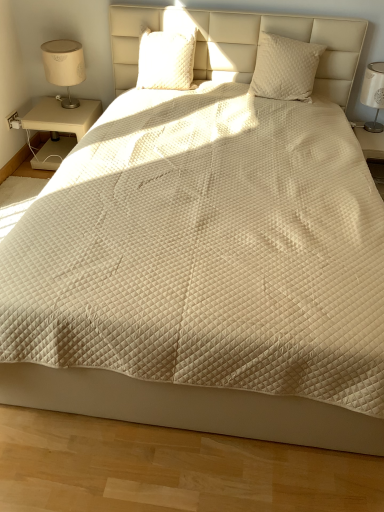
Question: Considering the relative sizes of beige wood nightstand at left and white fabric lampshade at right in the image provided, is beige wood nightstand at left smaller than white fabric lampshade at right?

Choices:
 (A) no
 (B) yes

Answer: (A)

Question: Does beige wood nightstand at left have a lesser height compared to white fabric lampshade at right?

Choices:
 (A) yes
 (B) no

Answer: (A)

Question: Is beige wood nightstand at left turned away from white fabric lampshade at right?

Choices:
 (A) no
 (B) yes

Answer: (A)

Question: From the image's perspective, does beige wood nightstand at left appear lower than white fabric lampshade at right?

Choices:
 (A) no
 (B) yes

Answer: (B)

Question: Is beige wood nightstand at left positioned before white fabric lampshade at right?

Choices:
 (A) yes
 (B) no

Answer: (B)

Question: From a real-world perspective, is beige wood nightstand at left physically above white fabric lampshade at right?

Choices:
 (A) yes
 (B) no

Answer: (B)

Question: From a real-world perspective, is white quilted pillow at upper right, the 2th pillow positioned from the left, under white quilted fabric at right?

Choices:
 (A) no
 (B) yes

Answer: (A)

Question: From the image's perspective, is white quilted pillow at upper right, the 2th pillow positioned from the left, on top of white quilted fabric at right?

Choices:
 (A) yes
 (B) no

Answer: (A)

Question: Is white quilted fabric at right at the back of white quilted pillow at upper right, which is counted as the 1th pillow, starting from the right?

Choices:
 (A) no
 (B) yes

Answer: (A)

Question: Is white quilted pillow at upper right, which is counted as the 1th pillow, starting from the right, wider than white quilted fabric at right?

Choices:
 (A) yes
 (B) no

Answer: (B)

Question: Is white quilted pillow at upper right, the 2th pillow positioned from the left, outside white quilted fabric at right?

Choices:
 (A) no
 (B) yes

Answer: (B)

Question: Considering the relative sizes of white quilted pillow at upper right, the 2th pillow positioned from the left, and white quilted fabric at right in the image provided, is white quilted pillow at upper right, the 2th pillow positioned from the left, taller than white quilted fabric at right?

Choices:
 (A) no
 (B) yes

Answer: (A)

Question: From the image's perspective, is white quilted fabric at right over white quilted pillow at upper right, the 2th pillow positioned from the left?

Choices:
 (A) yes
 (B) no

Answer: (B)